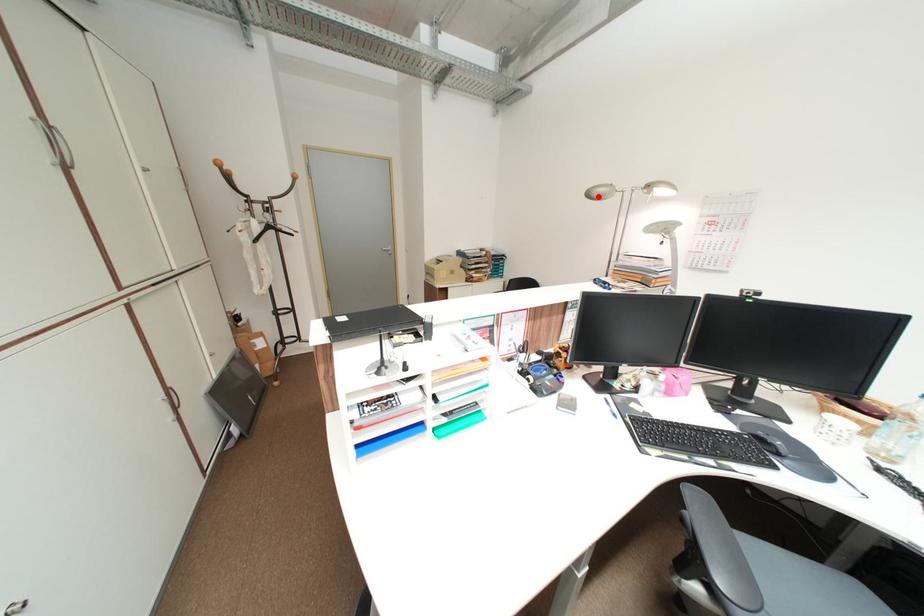
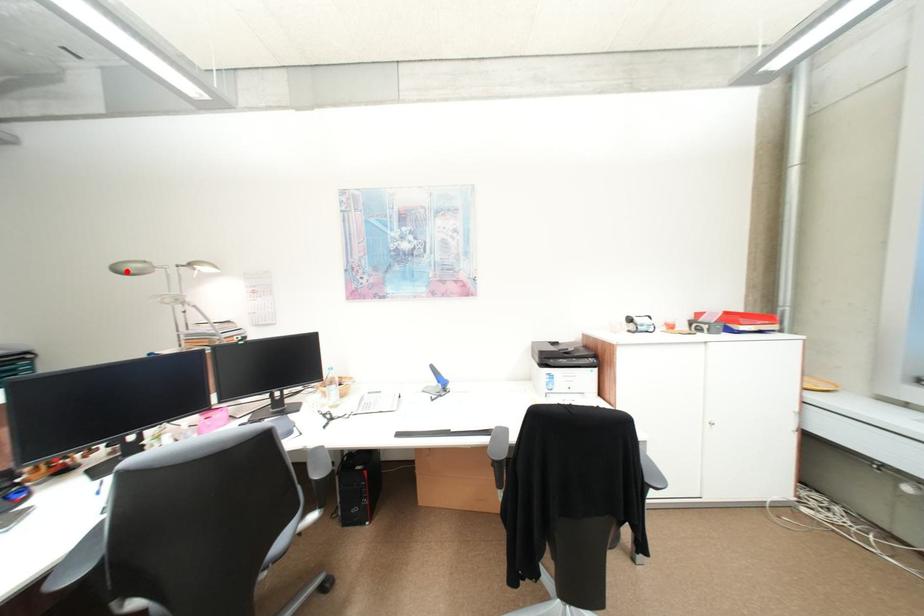
I am providing you with two images of the same scene from different viewpoints. A red point is marked on the first image and another point is marked on the second image. Is the red point in image1 aligned with the point shown in image2?

Yes